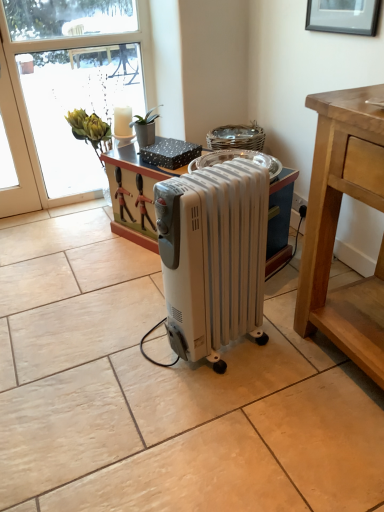
This screenshot has height=512, width=384. Find the location of `vacant space in front of white plastic radiator at center`. vacant space in front of white plastic radiator at center is located at coordinates (231, 407).